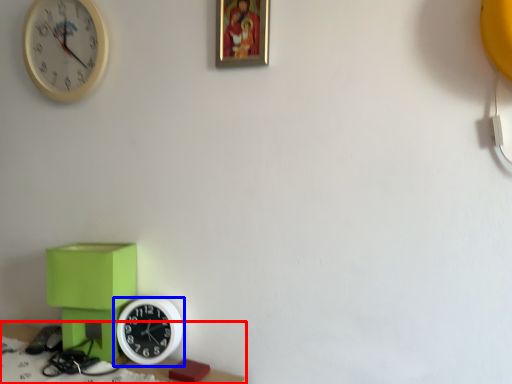
Question: Which of the following is the closest to the observer, table (highlighted by a red box) or wall clock (highlighted by a blue box)?

Choices:
 (A) table
 (B) wall clock

Answer: (A)